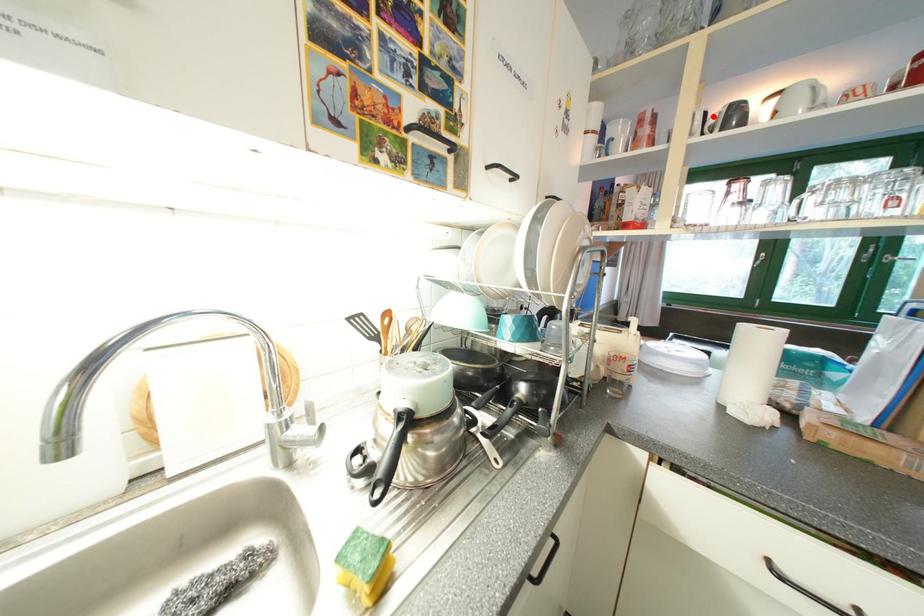
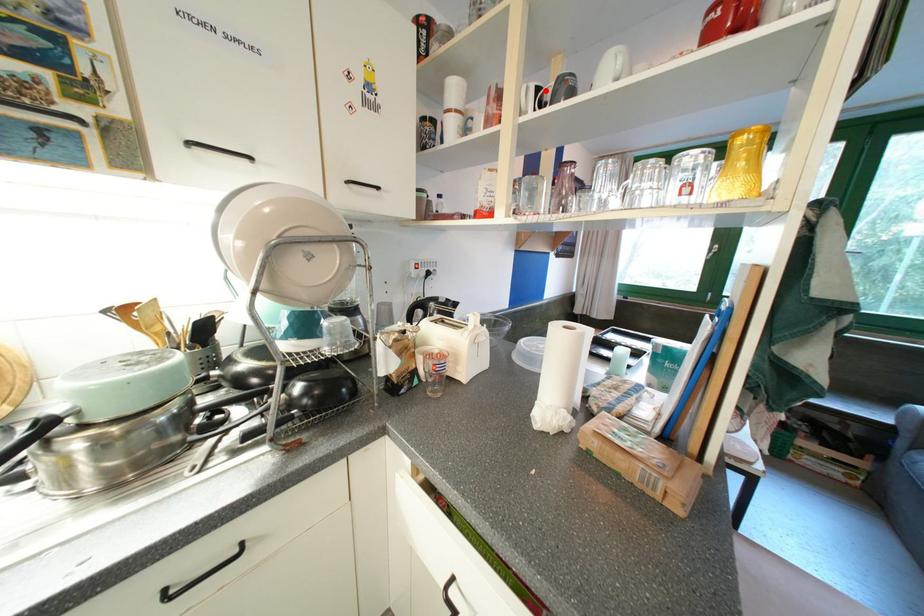
I am providing you with two images of the same scene from different viewpoints. A red point is marked on the first image and another point is marked on the second image. Are the points marked in image1 and image2 representing the same 3D position?

Yes